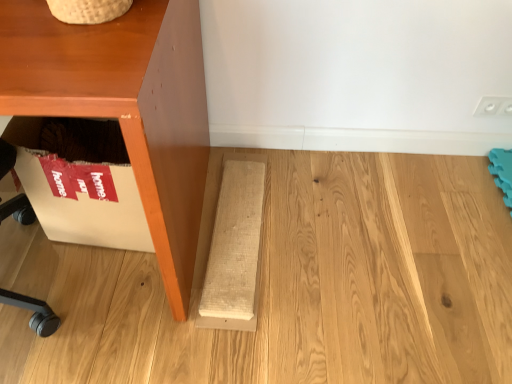
Question: Considering the relative sizes of matte brown cabinet at left and natural wood plank at lower center in the image provided, is matte brown cabinet at left thinner than natural wood plank at lower center?

Choices:
 (A) no
 (B) yes

Answer: (A)

Question: Is matte brown cabinet at left at the right side of natural wood plank at lower center?

Choices:
 (A) no
 (B) yes

Answer: (A)

Question: Is natural wood plank at lower center surrounded by matte brown cabinet at left?

Choices:
 (A) yes
 (B) no

Answer: (B)

Question: From the image's perspective, is matte brown cabinet at left located beneath natural wood plank at lower center?

Choices:
 (A) no
 (B) yes

Answer: (A)

Question: Can you confirm if matte brown cabinet at left is taller than natural wood plank at lower center?

Choices:
 (A) no
 (B) yes

Answer: (B)

Question: Is matte brown cabinet at left closer to camera compared to natural wood plank at lower center?

Choices:
 (A) yes
 (B) no

Answer: (A)

Question: Are natural wood plank at lower center and matte brown cabinet at left making contact?

Choices:
 (A) yes
 (B) no

Answer: (B)

Question: From a real-world perspective, does natural wood plank at lower center sit lower than matte brown cabinet at left?

Choices:
 (A) no
 (B) yes

Answer: (B)

Question: Is the position of natural wood plank at lower center less distant than that of matte brown cabinet at left?

Choices:
 (A) yes
 (B) no

Answer: (B)

Question: From the image's perspective, is natural wood plank at lower center located above matte brown cabinet at left?

Choices:
 (A) yes
 (B) no

Answer: (B)

Question: Can you confirm if natural wood plank at lower center is positioned to the left of matte brown cabinet at left?

Choices:
 (A) yes
 (B) no

Answer: (B)

Question: Is matte brown cabinet at left a part of natural wood plank at lower center?

Choices:
 (A) yes
 (B) no

Answer: (B)

Question: From a real-world perspective, is matte brown cabinet at left positioned above or below natural wood plank at lower center?

Choices:
 (A) below
 (B) above

Answer: (B)